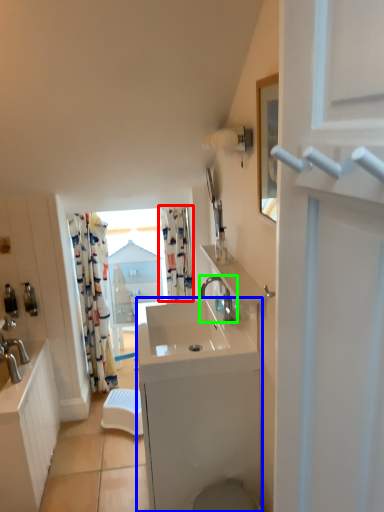
Question: Which is farther away from curtain (highlighted by a red box)? counter top (highlighted by a blue box) or tap (highlighted by a green box)?

Choices:
 (A) counter top
 (B) tap

Answer: (A)